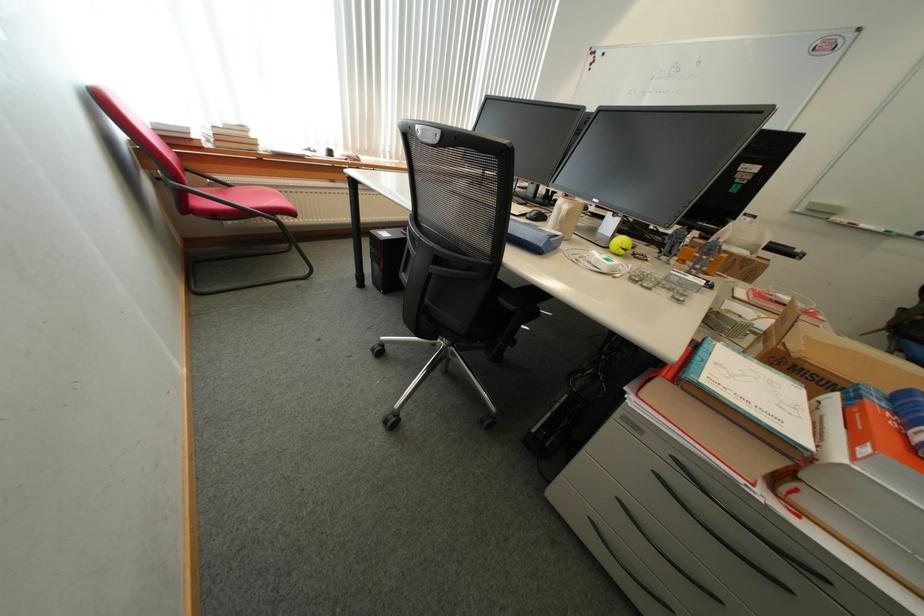
Find where to slid the black computer mouse. Please return your answer as a coordinate pair (x, y).

(536, 216)